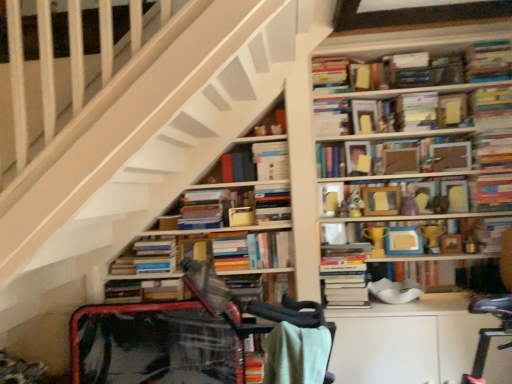
Locate an element on the screen. The width and height of the screenshot is (512, 384). free point above hardcover books at center, marked as the tenth book in a top-to-bottom arrangement (from a real-world perspective) is located at coordinates (202, 190).